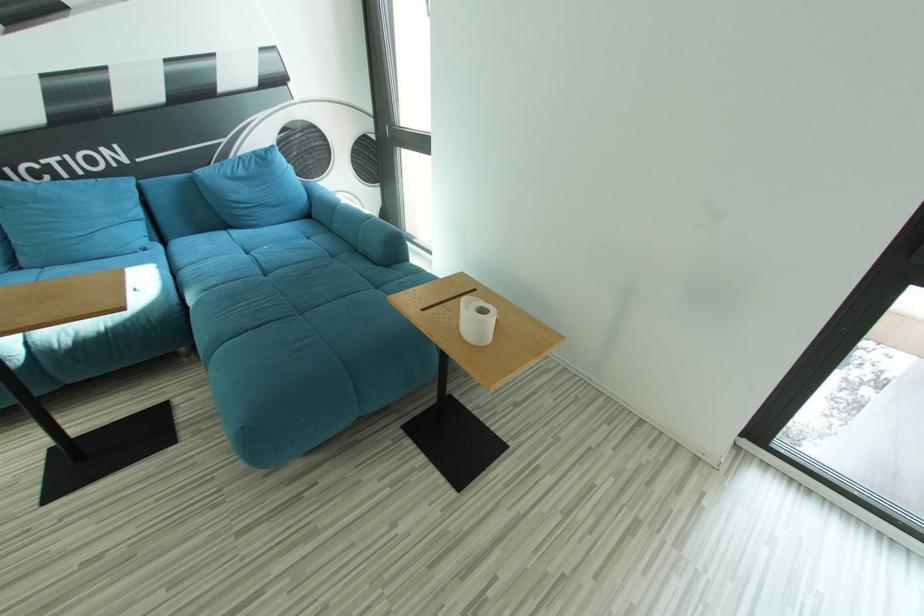
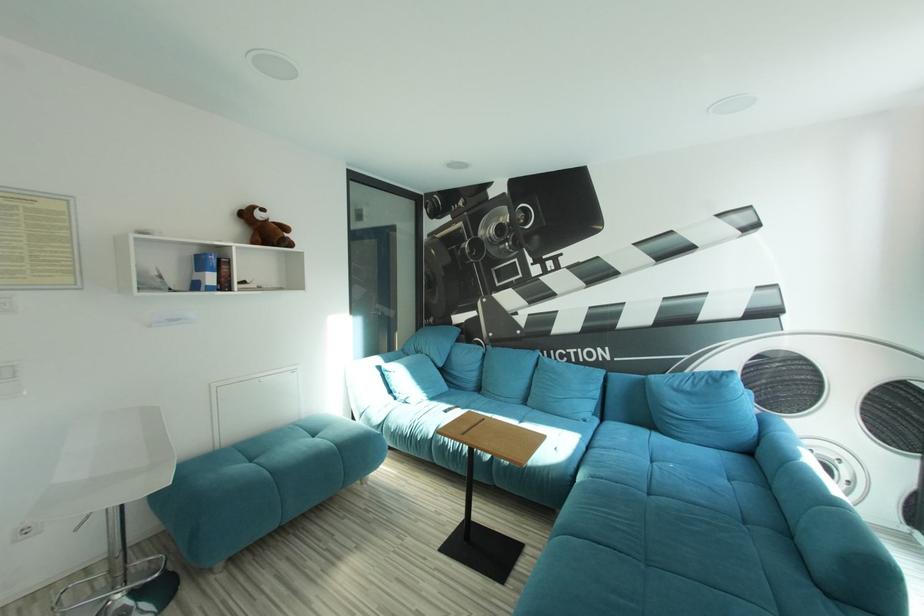
Question: The camera is either moving clockwise (left) or counter-clockwise (right) around the object. The first image is from the beginning of the video and the second image is from the end. Is the camera moving left or right when shooting the video?

Choices:
 (A) Left
 (B) Right

Answer: (B)